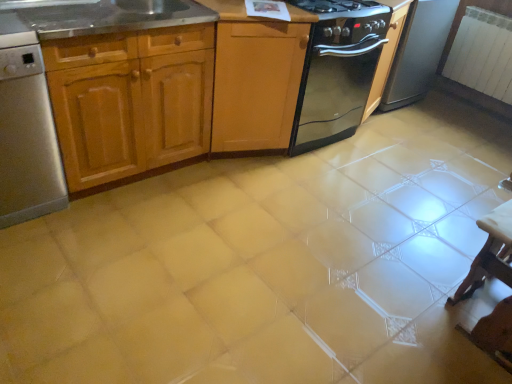
Locate an element on the screen. The width and height of the screenshot is (512, 384). white textured radiator at upper right is located at coordinates (482, 53).

Describe the element at coordinates (130, 101) in the screenshot. I see `wooden cabinet at left, acting as the second cabinetry starting from the right` at that location.

This screenshot has height=384, width=512. What are the coordinates of `wooden cabinet at left, the first cabinetry in the left-to-right sequence` in the screenshot? It's located at (130, 101).

Image resolution: width=512 pixels, height=384 pixels. Describe the element at coordinates (341, 8) in the screenshot. I see `black glass gas stove at upper center` at that location.

This screenshot has height=384, width=512. What are the coordinates of `stainless steel dishwasher at left` in the screenshot? It's located at (27, 135).

This screenshot has height=384, width=512. What do you see at coordinates (98, 16) in the screenshot? I see `stainless steel sink at upper left` at bounding box center [98, 16].

At what (x,y) coordinates should I click in order to perform the action: click on white textured radiator at upper right. Please return your answer as a coordinate pair (x, y). The image size is (512, 384). Looking at the image, I should click on tap(482, 53).

Is stainless steel dishwasher at left in front of or behind stainless steel sink at upper left in the image?

stainless steel dishwasher at left is positioned closer to the viewer than stainless steel sink at upper left.

In terms of width, does stainless steel dishwasher at left look wider or thinner when compared to stainless steel sink at upper left?

Considering their sizes, stainless steel dishwasher at left looks broader than stainless steel sink at upper left.

Is stainless steel dishwasher at left next to stainless steel sink at upper left and touching it?

No, stainless steel dishwasher at left is not touching stainless steel sink at upper left.

Consider the image. Who is taller, stainless steel dishwasher at left or stainless steel sink at upper left?

stainless steel dishwasher at left is taller.

Can you confirm if black glossy oven at upper right is positioned to the left of wooden cabinet at left, the first cabinetry in the left-to-right sequence?

No.

Considering the positions of objects black glossy oven at upper right and wooden cabinet at left, acting as the second cabinetry starting from the right, in the image provided, who is in front, black glossy oven at upper right or wooden cabinet at left, acting as the second cabinetry starting from the right,?

wooden cabinet at left, acting as the second cabinetry starting from the right, is more forward.

From a real-world perspective, is black glossy oven at upper right over wooden cabinet at left, the first cabinetry in the left-to-right sequence?

Yes, from a real-world perspective, black glossy oven at upper right is over wooden cabinet at left, the first cabinetry in the left-to-right sequence

Is black glossy oven at upper right looking in the opposite direction of wooden cabinet at left, the first cabinetry in the left-to-right sequence?

No, black glossy oven at upper right is not facing the opposite direction of wooden cabinet at left, the first cabinetry in the left-to-right sequence.

Does point (300, 31) appear closer or farther from the camera than point (67, 164)?

Point (300, 31).

From the image's perspective, which is below, light wood cabinet at center, which is the 1th cabinetry from right to left, or wooden cabinet at left, the first cabinetry in the left-to-right sequence?

wooden cabinet at left, the first cabinetry in the left-to-right sequence, is shown below in the image.

The height and width of the screenshot is (384, 512). Identify the location of cabinetry behind the wooden cabinet at left, acting as the second cabinetry starting from the right. (256, 84).

Who is bigger, light wood cabinet at center, which is the second cabinetry in left-to-right order, or wooden cabinet at left, the first cabinetry in the left-to-right sequence?

wooden cabinet at left, the first cabinetry in the left-to-right sequence, is bigger.

From a real-world perspective, count 1st cabinetrys downward from the stainless steel sink at upper left and point to it. Please provide its 2D coordinates.

[(256, 84)]

Is stainless steel sink at upper left bigger or smaller than light wood cabinet at center, which is the second cabinetry in left-to-right order?

Clearly, stainless steel sink at upper left is smaller in size than light wood cabinet at center, which is the second cabinetry in left-to-right order.

From the image's perspective, which one is positioned lower, stainless steel sink at upper left or light wood cabinet at center, which is the second cabinetry in left-to-right order?

light wood cabinet at center, which is the second cabinetry in left-to-right order, appears lower in the image.

Is white textured radiator at upper right taller than black glass stove at center?

Incorrect, the height of white textured radiator at upper right is not larger of that of black glass stove at center.

Would you say white textured radiator at upper right is to the left or to the right of black glass stove at center in the picture?

white textured radiator at upper right is positioned on black glass stove at center's right side.

Considering the relative sizes of white textured radiator at upper right and black glass stove at center in the image provided, is white textured radiator at upper right bigger than black glass stove at center?

Actually, white textured radiator at upper right might be smaller than black glass stove at center.

Is white textured radiator at upper right in contact with black glass stove at center?

No, white textured radiator at upper right is not touching black glass stove at center.

Between stainless steel sink at upper left and black glass gas stove at upper center, which one appears on the left side from the viewer's perspective?

stainless steel sink at upper left.

How much distance is there between stainless steel sink at upper left and black glass gas stove at upper center?

stainless steel sink at upper left and black glass gas stove at upper center are 31.91 inches apart from each other.

Is stainless steel sink at upper left in front of or behind black glass gas stove at upper center in the image?

In the image, stainless steel sink at upper left appears in front of black glass gas stove at upper center.

Considering the relative sizes of stainless steel sink at upper left and black glass gas stove at upper center in the image provided, is stainless steel sink at upper left wider than black glass gas stove at upper center?

Yes, stainless steel sink at upper left is wider than black glass gas stove at upper center.

Does light wood cabinet at center, which is the second cabinetry in left-to-right order, lie behind white textured radiator at upper right?

No, the depth of light wood cabinet at center, which is the second cabinetry in left-to-right order, is less than that of white textured radiator at upper right.

Can you tell me how much light wood cabinet at center, which is the 1th cabinetry from right to left, and white textured radiator at upper right differ in facing direction?

The angular difference between light wood cabinet at center, which is the 1th cabinetry from right to left, and white textured radiator at upper right is 90.7 degrees.

Is light wood cabinet at center, which is the 1th cabinetry from right to left, aimed at white textured radiator at upper right?

No, light wood cabinet at center, which is the 1th cabinetry from right to left, is not oriented towards white textured radiator at upper right.

Considering the sizes of objects light wood cabinet at center, which is the second cabinetry in left-to-right order, and white textured radiator at upper right in the image provided, who is wider, light wood cabinet at center, which is the second cabinetry in left-to-right order, or white textured radiator at upper right?

Wider between the two is light wood cabinet at center, which is the second cabinetry in left-to-right order.

The height and width of the screenshot is (384, 512). I want to click on countertop located behind the stainless steel dishwasher at left, so click(98, 16).

The height and width of the screenshot is (384, 512). Identify the location of the 2nd cabinetry in front of the black glossy oven at upper right, starting your count from the anchor. (130, 101).

Looking at the image, which one is located closer to white textured radiator at upper right, wooden cabinet at left, acting as the second cabinetry starting from the right, or stainless steel sink at upper left?

stainless steel sink at upper left is closer to white textured radiator at upper right.

Estimate the real-world distances between objects in this image. Which object is closer to white glossy table at lower right, wooden cabinet at left, acting as the second cabinetry starting from the right, or black glass gas stove at upper center?

Among the two, black glass gas stove at upper center is located nearer to white glossy table at lower right.

Which object lies nearer to the anchor point stainless steel dishwasher at left, black glossy oven at upper right or white glossy table at lower right?

The object closer to stainless steel dishwasher at left is white glossy table at lower right.

From the picture: Considering their positions, is white textured radiator at upper right positioned closer to black glass stove at center than white glossy table at lower right?

white glossy table at lower right.

Which object lies nearer to the anchor point black glass stove at center, stainless steel dishwasher at left or black glossy oven at upper right?

Among the two, black glossy oven at upper right is located nearer to black glass stove at center.

Estimate the real-world distances between objects in this image. Which object is closer to stainless steel dishwasher at left, white textured radiator at upper right or black glossy oven at upper right?

The object closer to stainless steel dishwasher at left is black glossy oven at upper right.

Based on their spatial positions, is white glossy table at lower right or stainless steel sink at upper left further from white textured radiator at upper right?

stainless steel sink at upper left.

Looking at the image, which one is located further to black glass stove at center, black glossy oven at upper right or light wood cabinet at center, which is the second cabinetry in left-to-right order?

black glossy oven at upper right is further to black glass stove at center.

Identify the location of cabinetry between stainless steel sink at upper left and black glass gas stove at upper center in the horizontal direction. (256, 84).

The width and height of the screenshot is (512, 384). Find the location of `gas stove between black glossy oven at upper right and white glossy table at lower right in the up-down direction`. gas stove between black glossy oven at upper right and white glossy table at lower right in the up-down direction is located at coordinates (341, 8).

The height and width of the screenshot is (384, 512). In order to click on cabinetry between stainless steel sink at upper left and white textured radiator at upper right in the horizontal direction in this screenshot , I will do `click(256, 84)`.

Where is `kitchen appliance between light wood cabinet at center, which is the second cabinetry in left-to-right order, and white textured radiator at upper right`? This screenshot has width=512, height=384. kitchen appliance between light wood cabinet at center, which is the second cabinetry in left-to-right order, and white textured radiator at upper right is located at coordinates (x=337, y=70).